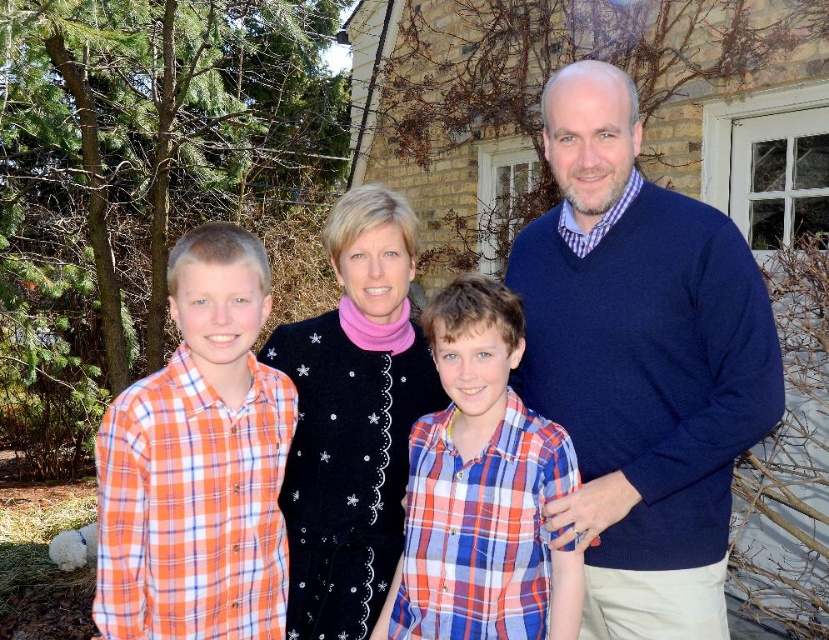
Question: Which of the following is the farthest from the observer?

Choices:
 (A) orange plaid shirt at left
 (B) plaid cotton shirt at center

Answer: (B)

Question: Is orange plaid shirt at left bigger than plaid cotton shirt at center?

Choices:
 (A) no
 (B) yes

Answer: (A)

Question: Can you confirm if navy blue sweater at right is smaller than plaid cotton shirt at center?

Choices:
 (A) no
 (B) yes

Answer: (A)

Question: Which point is closer to the camera?

Choices:
 (A) navy blue sweater at right
 (B) plaid cotton shirt at center

Answer: (B)

Question: Observing the image, what is the correct spatial positioning of navy blue sweater at right in reference to orange plaid shirt at left?

Choices:
 (A) above
 (B) below

Answer: (A)

Question: Estimate the real-world distances between objects in this image. Which object is closer to the plaid cotton shirt at center?

Choices:
 (A) black velvet sweater at center
 (B) orange plaid shirt at left
 (C) navy blue sweater at right

Answer: (C)